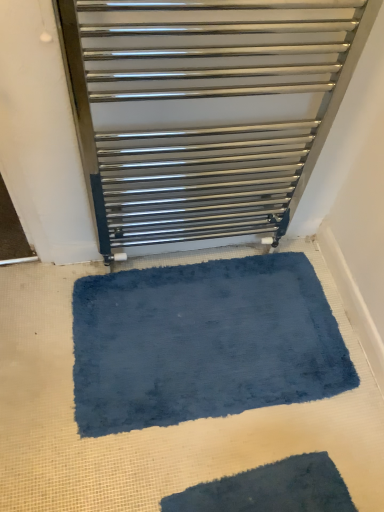
The image size is (384, 512). What are the coordinates of `vacant space underneath dark blue shaggy bath mat at lower center, which appears as the second bath mat when viewed from the top (from a real-world perspective)` in the screenshot? It's located at (264, 493).